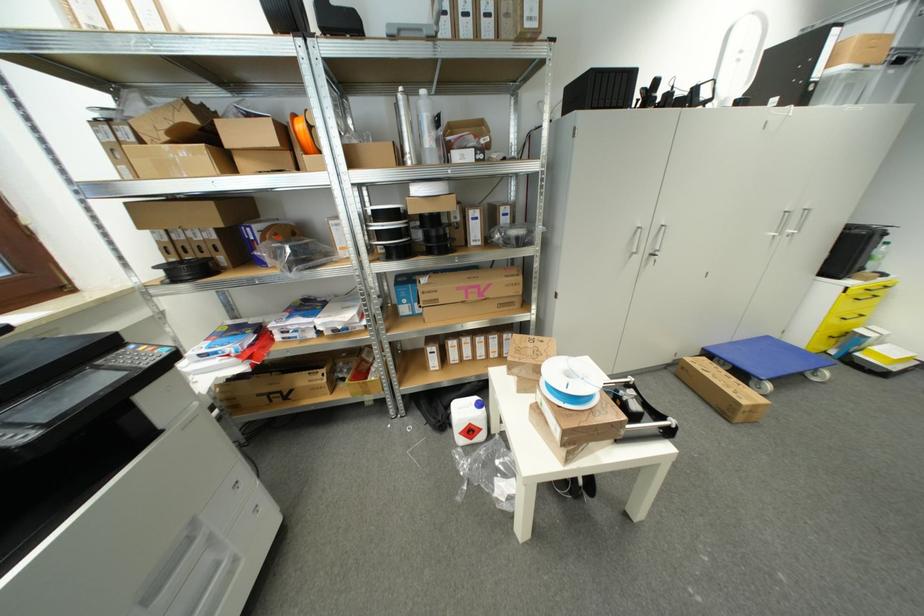
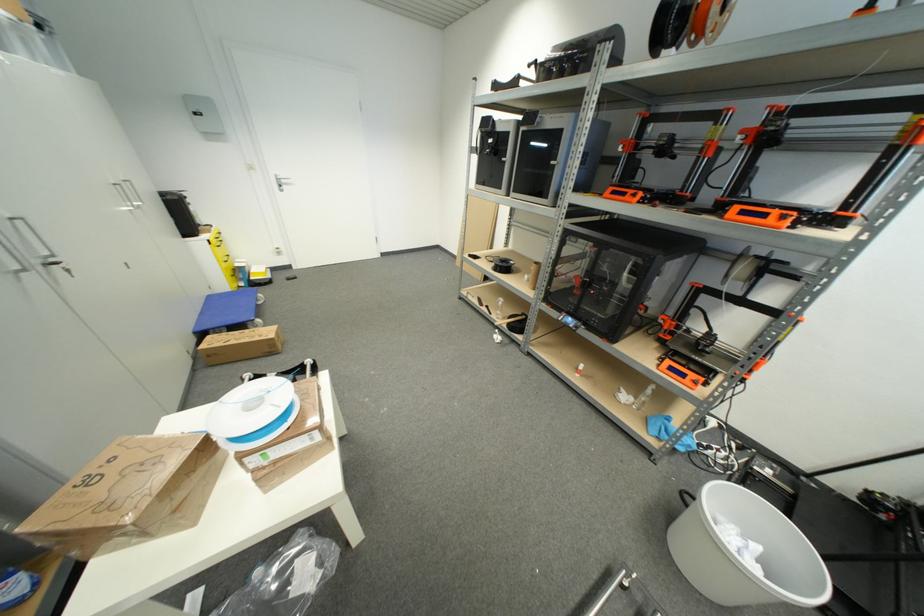
Where in the second image is the point corresponding to point (659, 257) from the first image?

(59, 265)